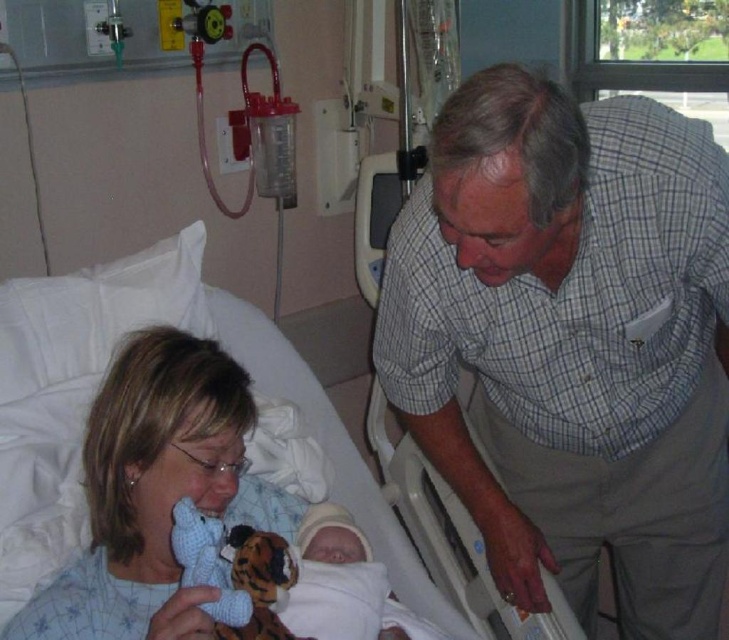
Question: Is gray checkered shirt at upper right below soft white blanket at center?

Choices:
 (A) yes
 (B) no

Answer: (B)

Question: Does knitted blue bear at lower left appear on the right side of rubber teething ring at lower right?

Choices:
 (A) no
 (B) yes

Answer: (A)

Question: Which point is farther to the camera?

Choices:
 (A) blue fabric at left
 (B) soft white blanket at center
 (C) gray checkered shirt at upper right
 (D) knitted blue bear at lower left

Answer: (B)

Question: Which point is closer to the camera?

Choices:
 (A) (574, 298)
 (B) (222, 509)

Answer: (A)

Question: Considering the real-world distances, which object is farthest from the knitted blue bear at lower left?

Choices:
 (A) soft white blanket at center
 (B) rubber teething ring at lower right
 (C) blue fabric at left
 (D) gray checkered shirt at upper right

Answer: (D)

Question: Is gray checkered shirt at upper right thinner than knitted blue bear at lower left?

Choices:
 (A) yes
 (B) no

Answer: (B)